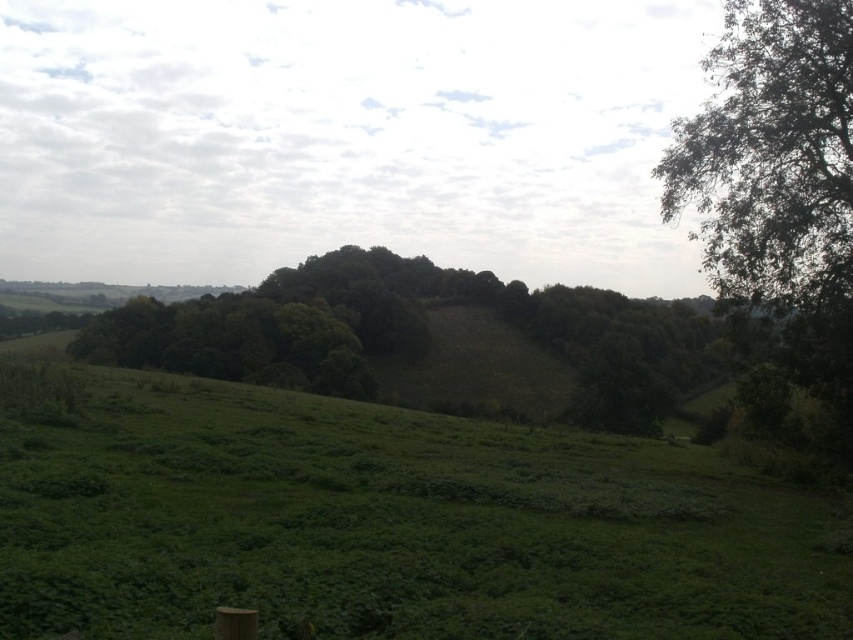
You are standing at the center of the grassy field in the foreground. You want to walk to the green leafy tree at right. Which direction should you head towards?

The green leafy tree at right is located at coordinates point (778, 195), so you should head towards the right direction to reach it.

You are a hiker who wants to take a photo of both the green leafy tree at right and the green leafy tree at center. Which tree should you stand closer to in order to fit both into your camera frame?

You should stand closer to the green leafy tree at center because it is smaller in size than the green leafy tree at right, allowing you to capture both within the frame by positioning yourself nearer to the smaller one.